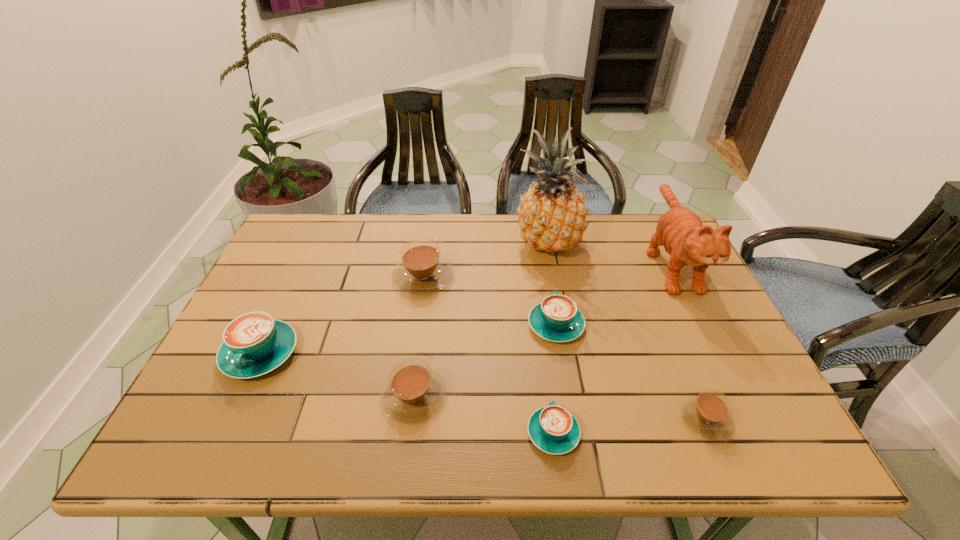
Find the location of a particular element. yellow pineapple is located at coordinates (552, 216).

The height and width of the screenshot is (540, 960). Identify the location of pineapple. (552, 216).

At what (x,y) coordinates should I click in order to perform the action: click on the seventh shortest object. Please return your answer as a coordinate pair (x, y). This screenshot has width=960, height=540. Looking at the image, I should click on (686, 240).

This screenshot has height=540, width=960. What are the coordinates of `orange cat` in the screenshot? It's located at 686,240.

Where is `the farthest brown cappuccino`? The image size is (960, 540). the farthest brown cappuccino is located at coordinates (422, 270).

What are the coordinates of `the farthest cappuccino` in the screenshot? It's located at (422, 270).

This screenshot has width=960, height=540. In order to click on the leftmost object in this screenshot , I will do `click(254, 343)`.

You are a GUI agent. You are given a task and a screenshot of the screen. Output one action in this format:
    pyautogui.click(x=<x>, y=<y>)
    Task: Click on the leftmost cappuccino
    This screenshot has height=540, width=960.
    Given the screenshot: What is the action you would take?
    pyautogui.click(x=254, y=343)

Locate an element on the screen. Image resolution: width=960 pixels, height=540 pixels. the second biggest brown cappuccino is located at coordinates (413, 393).

At what (x,y) coordinates should I click in order to perform the action: click on the second biggest turquoise cappuccino. Please return your answer as a coordinate pair (x, y). Looking at the image, I should click on 556,318.